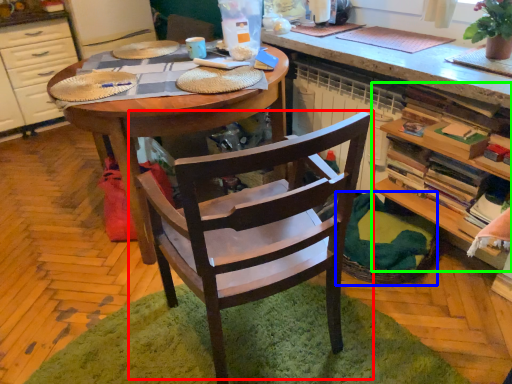
Question: Which is farther away from chair (highlighted by a red box)? basket (highlighted by a blue box) or shelf (highlighted by a green box)?

Choices:
 (A) basket
 (B) shelf

Answer: (B)